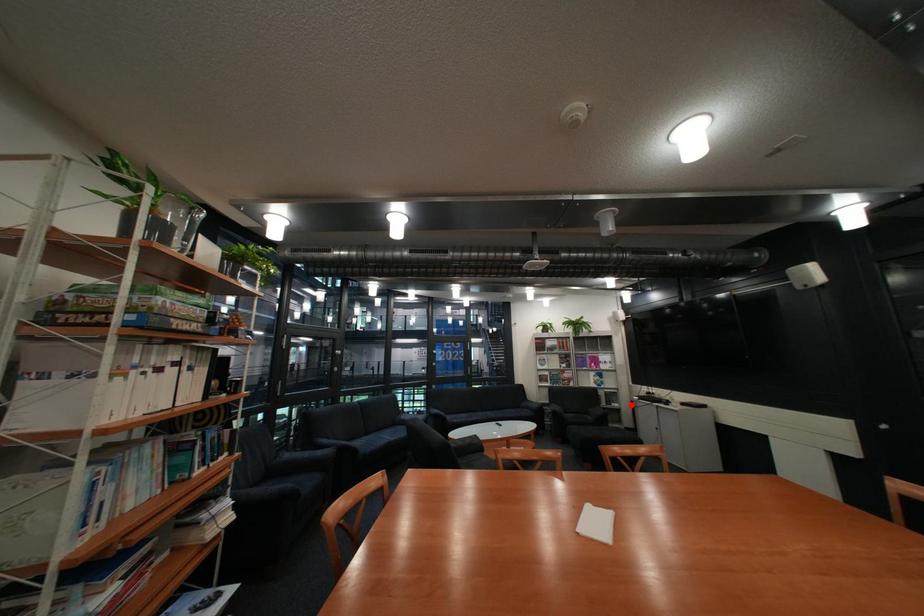
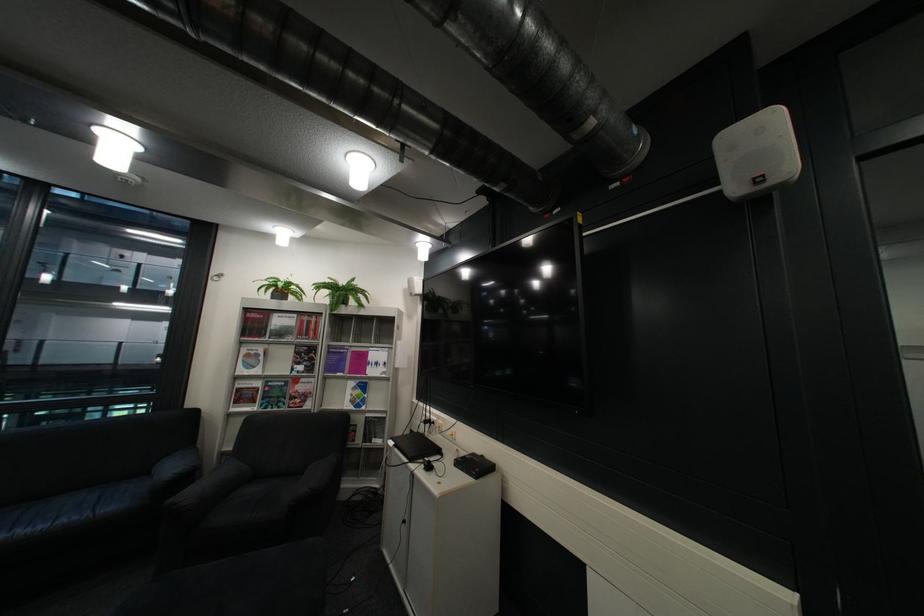
In the second image, find the point that corresponds to the highlighted location in the first image.

(393, 442)